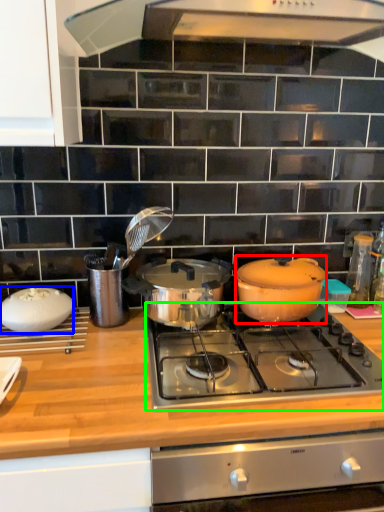
Question: Which object is the farthest from pot/pan (highlighted by a red box)? Choose among these: kitchen appliance (highlighted by a blue box) or gas stove (highlighted by a green box).

Choices:
 (A) kitchen appliance
 (B) gas stove

Answer: (A)